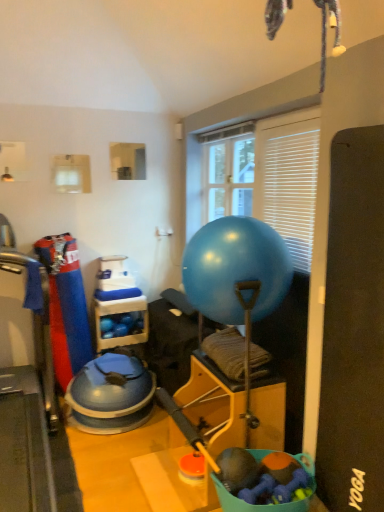
This screenshot has width=384, height=512. I want to click on blue rubber ball at center, so click(236, 270).

Locate an element on the screen. The height and width of the screenshot is (512, 384). rubberized fabric dog toy at lower center is located at coordinates (251, 504).

Which object is wider, white blinds at upper right, which is counted as the 2th window screen, starting from the left, or blue rubber ball at center?

With larger width is blue rubber ball at center.

Is white blinds at upper right, which ranks as the 1th window screen in right-to-left order, oriented away from blue rubber ball at center?

That's not correct — white blinds at upper right, which ranks as the 1th window screen in right-to-left order, is not looking away from blue rubber ball at center.

Does white blinds at upper right, which ranks as the 1th window screen in right-to-left order, lie behind blue rubber ball at center?

Yes, it is.

From the image's perspective, is white blinds at upper right, which is counted as the 2th window screen, starting from the left, over blue rubber ball at center?

Yes, from the image's perspective, white blinds at upper right, which is counted as the 2th window screen, starting from the left, is above blue rubber ball at center.

Based on the photo, is white blinds at upper right, which is counted as the 2th window screen, starting from the left, smaller than rubberized fabric dog toy at lower center?

Yes.

Which object is closer to the camera, white blinds at upper right, which is the 2th window screen in back-to-front order, or rubberized fabric dog toy at lower center?

rubberized fabric dog toy at lower center is more forward.

From the image's perspective, would you say white blinds at upper right, which is counted as the 1th window screen, starting from the front, is shown under rubberized fabric dog toy at lower center?

Actually, white blinds at upper right, which is counted as the 1th window screen, starting from the front, appears above rubberized fabric dog toy at lower center in the image.

Considering the relative sizes of white blinds at upper right, which is the 2th window screen in back-to-front order, and rubberized fabric dog toy at lower center in the image provided, is white blinds at upper right, which is the 2th window screen in back-to-front order, wider than rubberized fabric dog toy at lower center?

No, white blinds at upper right, which is the 2th window screen in back-to-front order, is not wider than rubberized fabric dog toy at lower center.

Is blue rubber ball at center to the left of white blinds at upper right, which ranks as the 1th window screen in right-to-left order, from the viewer's perspective?

Indeed, blue rubber ball at center is positioned on the left side of white blinds at upper right, which ranks as the 1th window screen in right-to-left order.

Is blue rubber ball at center positioned far away from white blinds at upper right, which is the 2th window screen in back-to-front order?

No, blue rubber ball at center is not far from white blinds at upper right, which is the 2th window screen in back-to-front order.

Which is behind, point (230, 282) or point (293, 156)?

Point (293, 156)

Measure the distance from blue rubber ball at center to white blinds at upper right, which is counted as the 1th window screen, starting from the front.

blue rubber ball at center is 15.27 inches from white blinds at upper right, which is counted as the 1th window screen, starting from the front.

In the scene shown: From the image's perspective, which one is positioned higher, rubberized fabric dog toy at lower center or transparent plastic window screen at center, the first window screen positioned from the back?

transparent plastic window screen at center, the first window screen positioned from the back, is shown above in the image.

Which of these two, rubberized fabric dog toy at lower center or transparent plastic window screen at center, the first window screen positioned from the back, is smaller?

rubberized fabric dog toy at lower center is smaller.

Is rubberized fabric dog toy at lower center placed right next to transparent plastic window screen at center, which ranks as the 2th window screen in front-to-back order?

rubberized fabric dog toy at lower center and transparent plastic window screen at center, which ranks as the 2th window screen in front-to-back order, are clearly separated.

In terms of height, does rubberized fabric dog toy at lower center look taller or shorter compared to transparent plastic window screen at center, which appears as the 2th window screen when viewed from the right?

rubberized fabric dog toy at lower center is shorter than transparent plastic window screen at center, which appears as the 2th window screen when viewed from the right.

Considering the positions of points (46, 486) and (276, 257), is point (46, 486) closer to camera compared to point (276, 257)?

That is False.

Based on their sizes in the image, would you say blue rubber mat at left is bigger or smaller than blue rubber ball at center?

blue rubber mat at left is bigger than blue rubber ball at center.

From the image's perspective, is blue rubber mat at left over blue rubber ball at center?

No, from the image's perspective, blue rubber mat at left is not above blue rubber ball at center.

In the scene shown: Is blue rubber mat at left positioned far away from blue rubber ball at center?

blue rubber mat at left is far away from blue rubber ball at center.

From the image's perspective, between transparent plastic window screen at center, which ranks as the 2th window screen in front-to-back order, and blue rubber ball at center, who is located below?

blue rubber ball at center is shown below in the image.

Who is taller, transparent plastic window screen at center, which ranks as the 2th window screen in front-to-back order, or blue rubber ball at center?

transparent plastic window screen at center, which ranks as the 2th window screen in front-to-back order.

Based on the photo, from a real-world perspective, is transparent plastic window screen at center, the first window screen positioned from the back, physically below blue rubber ball at center?

No, from a real-world perspective, transparent plastic window screen at center, the first window screen positioned from the back, is not under blue rubber ball at center.

Is transparent plastic window screen at center, the first window screen viewed from the left, oriented away from blue rubber ball at center?

No, transparent plastic window screen at center, the first window screen viewed from the left, is not facing away from blue rubber ball at center.

Which is more to the left, blue rubber ball at center or transparent plastic window screen at center, the first window screen positioned from the back?

From the viewer's perspective, blue rubber ball at center appears more on the left side.

Locate an element on the screen. Image resolution: width=384 pixels, height=512 pixels. the 1st window screen to the right of the blue rubber ball at center, counting from the anchor's position is located at coordinates (229, 177).

Can you tell me how much blue rubber ball at center and transparent plastic window screen at center, the first window screen viewed from the left, differ in facing direction?

0.526 degrees separate the facing orientations of blue rubber ball at center and transparent plastic window screen at center, the first window screen viewed from the left.

Between blue rubber ball at center and transparent plastic window screen at center, which appears as the 2th window screen when viewed from the right, which one has less height?

blue rubber ball at center.

Locate an element on the screen. ball below the white blinds at upper right, which is counted as the 2th window screen, starting from the left (from the image's perspective) is located at coordinates (236, 270).

Locate an element on the screen. This screenshot has width=384, height=512. toy located underneath the white blinds at upper right, which is counted as the 2th window screen, starting from the left (from a real-world perspective) is located at coordinates (251, 504).

Estimate the real-world distances between objects in this image. Which object is closer to transparent plastic window screen at center, the first window screen viewed from the left, white blinds at upper right, which ranks as the 1th window screen in right-to-left order, or rubberized fabric dog toy at lower center?

white blinds at upper right, which ranks as the 1th window screen in right-to-left order, is positioned closer to the anchor transparent plastic window screen at center, the first window screen viewed from the left.

From the image, which object appears to be nearer to transparent plastic window screen at center, which appears as the 2th window screen when viewed from the right, rubberized fabric dog toy at lower center or blue rubber mat at left?

blue rubber mat at left is closer to transparent plastic window screen at center, which appears as the 2th window screen when viewed from the right.

Based on their spatial positions, is white blinds at upper right, which is the 2th window screen in back-to-front order, or blue rubber ball at center further from transparent plastic window screen at center, the first window screen viewed from the left?

Among the two, blue rubber ball at center is located further to transparent plastic window screen at center, the first window screen viewed from the left.

Considering their positions, is white blinds at upper right, which is the 2th window screen in back-to-front order, positioned further to blue rubber mat at left than blue rubber ball at center?

white blinds at upper right, which is the 2th window screen in back-to-front order, lies further to blue rubber mat at left than the other object.

Considering their positions, is transparent plastic window screen at center, which appears as the 2th window screen when viewed from the right, positioned closer to blue rubber ball at center than blue rubber mat at left?

transparent plastic window screen at center, which appears as the 2th window screen when viewed from the right.

Which object lies nearer to the anchor point white blinds at upper right, which is counted as the 2th window screen, starting from the left, blue rubber ball at center or transparent plastic window screen at center, which ranks as the 2th window screen in front-to-back order?

The object closer to white blinds at upper right, which is counted as the 2th window screen, starting from the left, is blue rubber ball at center.

Considering their positions, is blue rubber ball at center positioned further to rubberized fabric dog toy at lower center than blue rubber mat at left?

The object further to rubberized fabric dog toy at lower center is blue rubber mat at left.

From the image, which object appears to be nearer to rubberized fabric dog toy at lower center, white blinds at upper right, which is the 2th window screen in back-to-front order, or blue rubber ball at center?

blue rubber ball at center lies closer to rubberized fabric dog toy at lower center than the other object.

Where is `ball between blue rubber mat at left and rubberized fabric dog toy at lower center in the horizontal direction`? ball between blue rubber mat at left and rubberized fabric dog toy at lower center in the horizontal direction is located at coordinates (236, 270).

Locate an element on the screen. Image resolution: width=384 pixels, height=512 pixels. window screen positioned between blue rubber ball at center and transparent plastic window screen at center, the first window screen positioned from the back, from near to far is located at coordinates (288, 182).

You are a GUI agent. You are given a task and a screenshot of the screen. Output one action in this format:
    pyautogui.click(x=<x>, y=<y>)
    Task: Click on the ball that lies between white blinds at upper right, which is the 2th window screen in back-to-front order, and rubberized fabric dog toy at lower center from top to bottom
    The image size is (384, 512).
    Given the screenshot: What is the action you would take?
    pyautogui.click(x=236, y=270)

Image resolution: width=384 pixels, height=512 pixels. I want to click on ball between blue rubber mat at left and white blinds at upper right, which ranks as the 1th window screen in right-to-left order, in the horizontal direction, so click(236, 270).